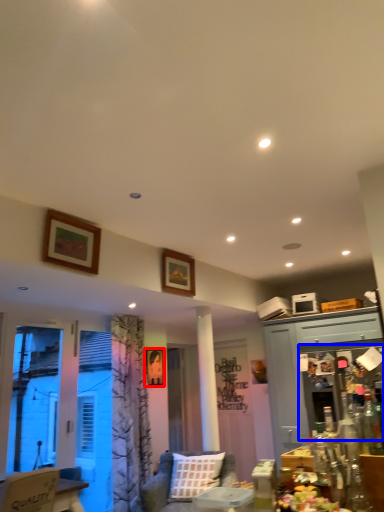
Question: Which of the following is the closest to the observer, picture frame (highlighted by a red box) or screen door (highlighted by a blue box)?

Choices:
 (A) picture frame
 (B) screen door

Answer: (B)